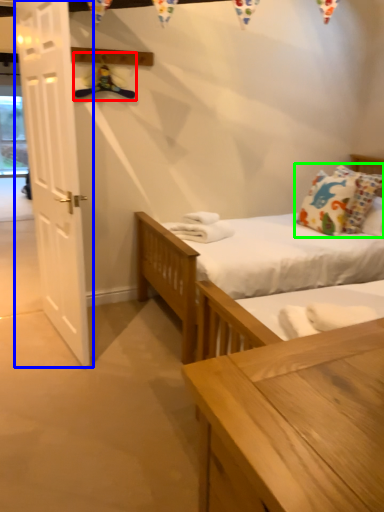
Question: Which object is positioned closest to hanger (highlighted by a red box)? Select from door (highlighted by a blue box) and pillow (highlighted by a green box).

Choices:
 (A) door
 (B) pillow

Answer: (A)